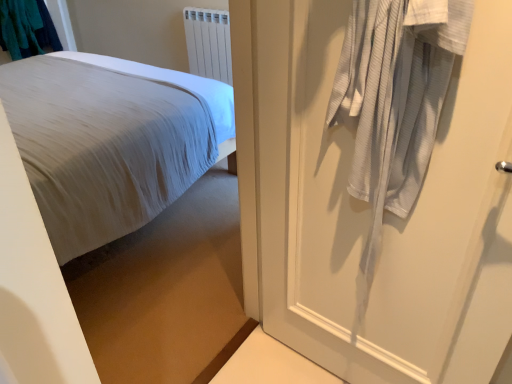
Question: From a real-world perspective, is white plastic radiator at upper center positioned above or below white textured door at right?

Choices:
 (A) below
 (B) above

Answer: (A)

Question: From their relative heights in the image, would you say white plastic radiator at upper center is taller or shorter than white textured door at right?

Choices:
 (A) short
 (B) tall

Answer: (A)

Question: Which object is positioned farthest from the white plastic radiator at upper center?

Choices:
 (A) white textured door at right
 (B) white cotton bed at left
 (C) teal fabric laundry at upper left

Answer: (A)

Question: Estimate the real-world distances between objects in this image. Which object is farther from the teal fabric laundry at upper left?

Choices:
 (A) white cotton bed at left
 (B) white plastic radiator at upper center
 (C) white textured door at right

Answer: (C)